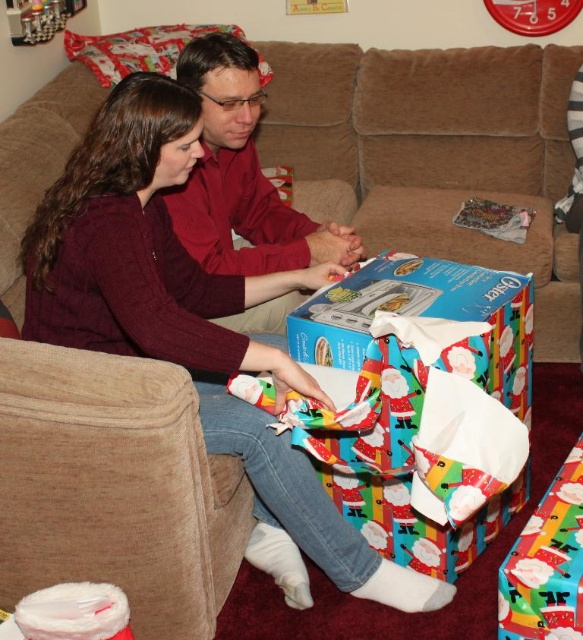
Question: Is the position of brown fabric couch at center more distant than that of matte red shirt at center?

Choices:
 (A) no
 (B) yes

Answer: (B)

Question: Is brown fabric couch at center to the right of matte red shirt at center from the viewer's perspective?

Choices:
 (A) no
 (B) yes

Answer: (B)

Question: Based on their relative distances, which object is farther from the brown fabric couch at center?

Choices:
 (A) matte maroon sweater at center
 (B) matte red shirt at center

Answer: (A)

Question: Which point appears closest to the camera in this image?

Choices:
 (A) click(64, 262)
 (B) click(238, 97)

Answer: (A)

Question: Does brown fabric couch at center have a lesser width compared to matte maroon sweater at center?

Choices:
 (A) no
 (B) yes

Answer: (A)

Question: Among these objects, which one is farthest from the camera?

Choices:
 (A) matte maroon sweater at center
 (B) brown fabric couch at center
 (C) matte red shirt at center

Answer: (B)